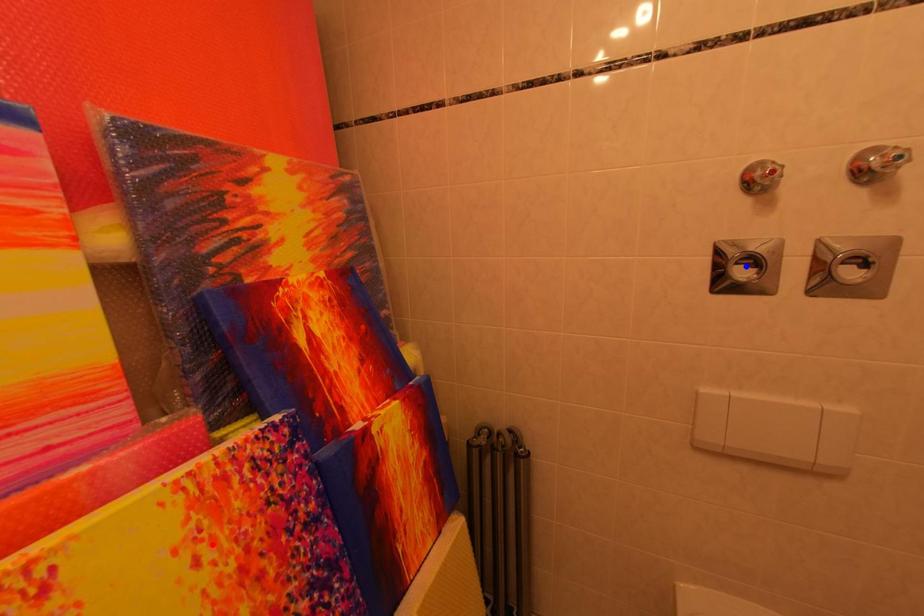
Question: Which of the two points in the image is closer to the camera?

Choices:
 (A) Blue point is closer.
 (B) Red point is closer.

Answer: (B)